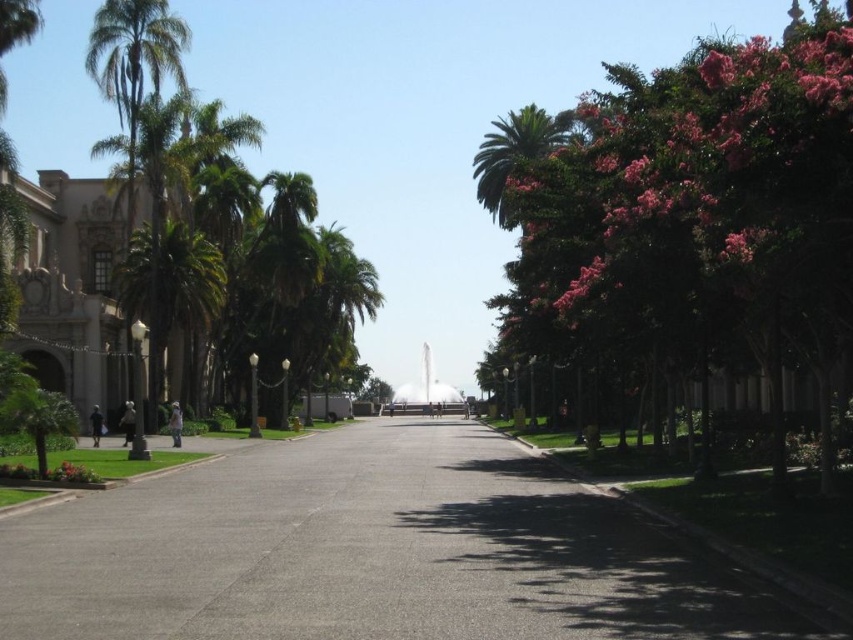
Does gray asphalt pavement at center lie behind green leafy palm tree at left?

No, it is not.

Between point (509, 468) and point (175, 317), which one is positioned in front?

Point (509, 468)

You are a GUI agent. You are given a task and a screenshot of the screen. Output one action in this format:
    pyautogui.click(x=<x>, y=<y>)
    Task: Click on the gray asphalt pavement at center
    Image resolution: width=853 pixels, height=640 pixels.
    Given the screenshot: What is the action you would take?
    pyautogui.click(x=372, y=552)

Can you confirm if gray asphalt pavement at center is thinner than green leafy tree at right?

Yes.

I want to click on gray asphalt pavement at center, so click(x=372, y=552).

Where is `gray asphalt pavement at center`? gray asphalt pavement at center is located at coordinates (372, 552).

This screenshot has width=853, height=640. Find the location of `gray asphalt pavement at center`. gray asphalt pavement at center is located at coordinates (372, 552).

Which is above, green leafy tree at right or green leafy palm tree at left?

green leafy tree at right

Is point (830, 120) positioned before point (209, 250)?

Yes, it is in front of point (209, 250).

Does point (692, 51) come in front of point (209, 300)?

No, (692, 51) is behind (209, 300).

Identify the location of green leafy tree at right. The width and height of the screenshot is (853, 640). (688, 224).